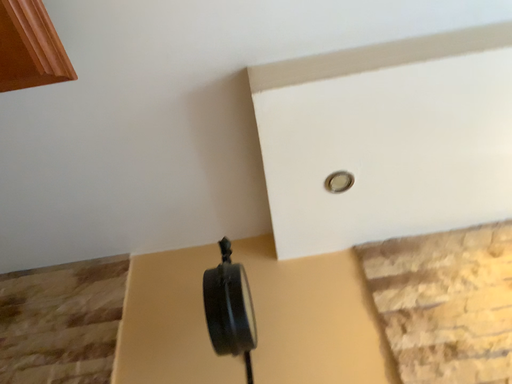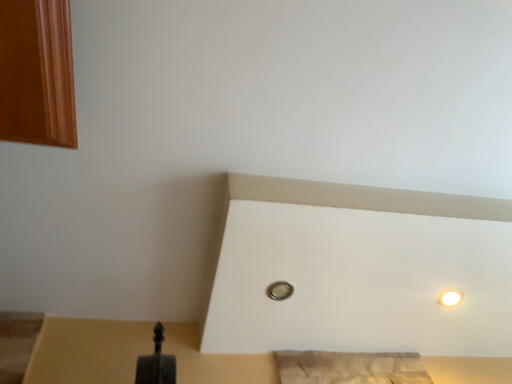
Question: Which way did the camera rotate in the video?

Choices:
 (A) rotated right
 (B) rotated left

Answer: (A)